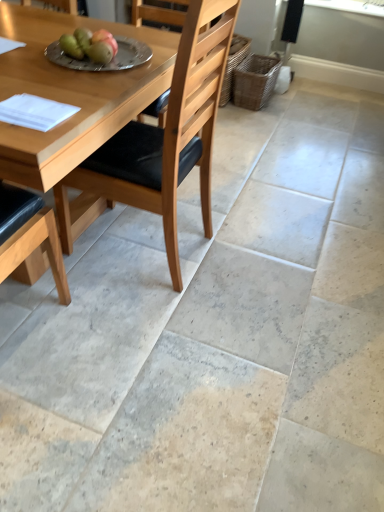
The image size is (384, 512). Find the location of `vacant area that is in front of white paper at lower left`. vacant area that is in front of white paper at lower left is located at coordinates (26, 139).